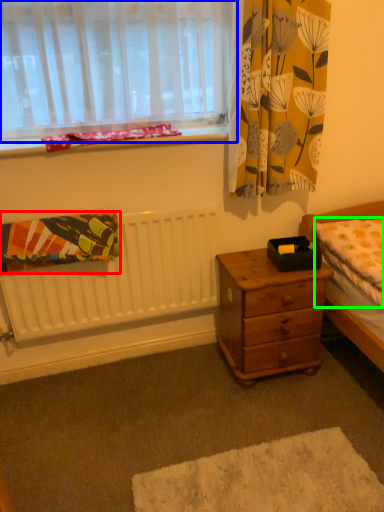
Question: Which object is the closest to the blanket (highlighted by a red box)? Choose among these: window (highlighted by a blue box) or mattress (highlighted by a green box).

Choices:
 (A) window
 (B) mattress

Answer: (A)